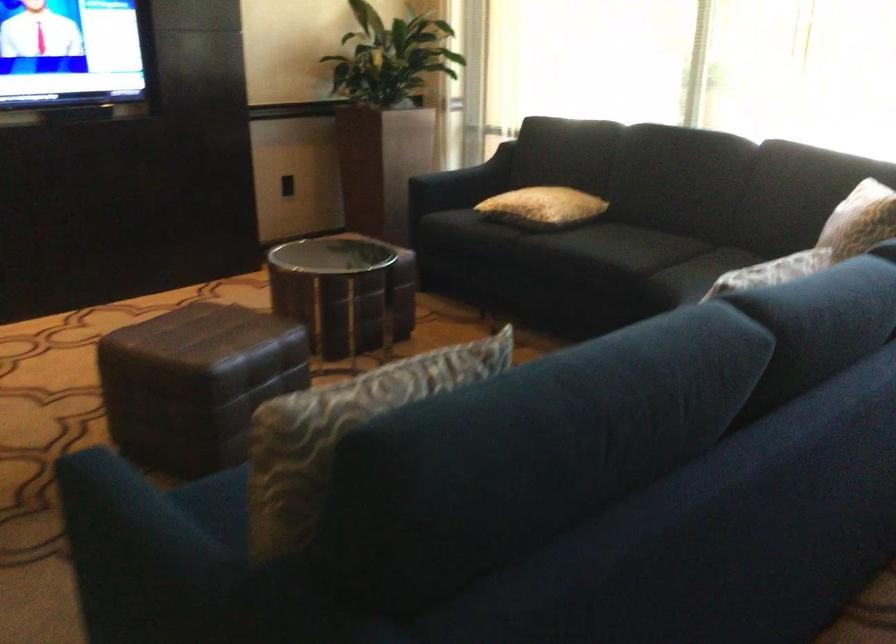
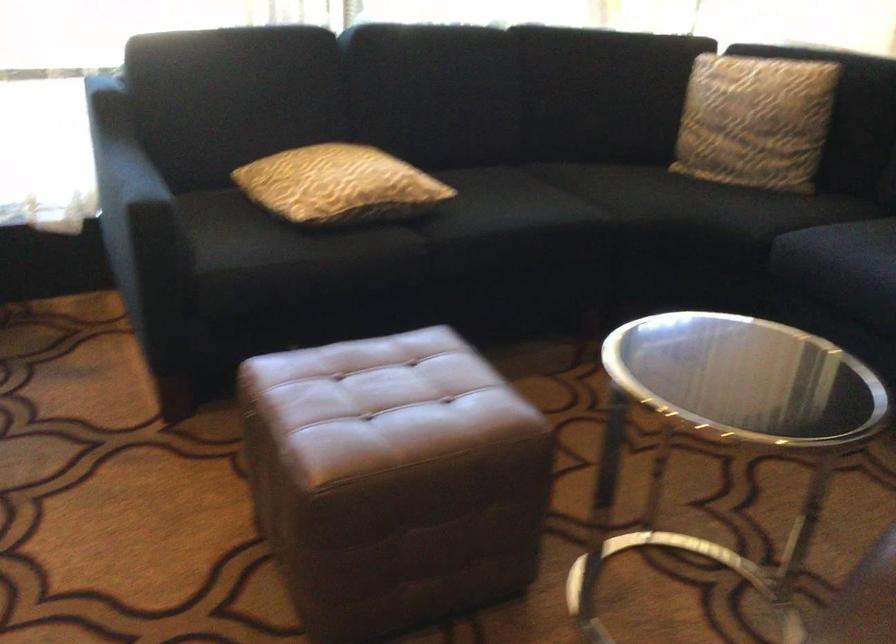
The point at (814,240) is marked in the first image. Where is the corresponding point in the second image?

(754, 120)